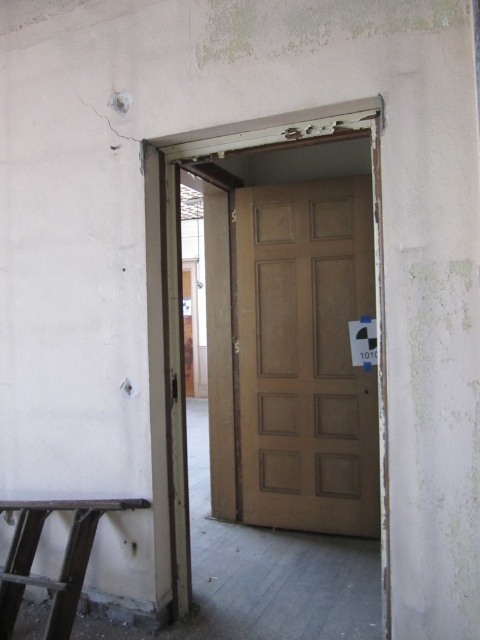
Which is more to the left, matte brown door at center or metallic stool at lower left?

From the viewer's perspective, metallic stool at lower left appears more on the left side.

Does matte brown door at center have a lesser width compared to metallic stool at lower left?

In fact, matte brown door at center might be wider than metallic stool at lower left.

Between point (355, 465) and point (132, 504), which one is positioned behind?

The point (355, 465) is behind.

Locate an element on the screen. matte brown door at center is located at coordinates (305, 356).